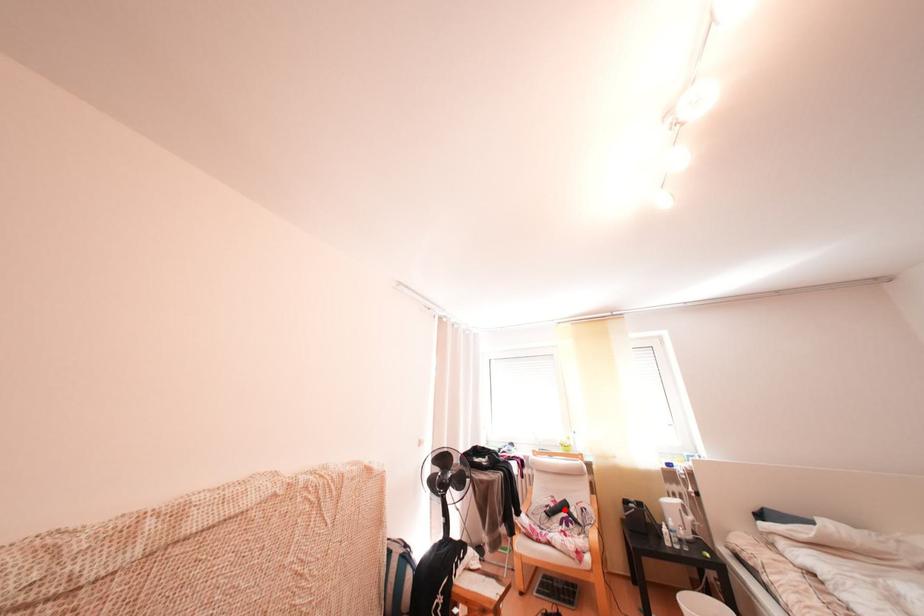
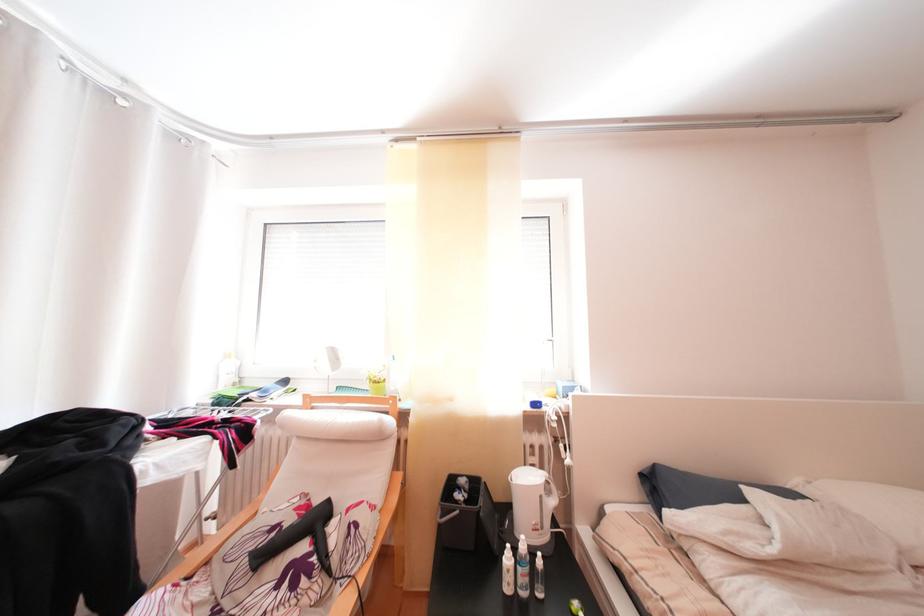
The point at the highlighted location is marked in the first image. Where is the corresponding point in the second image?

(301, 525)